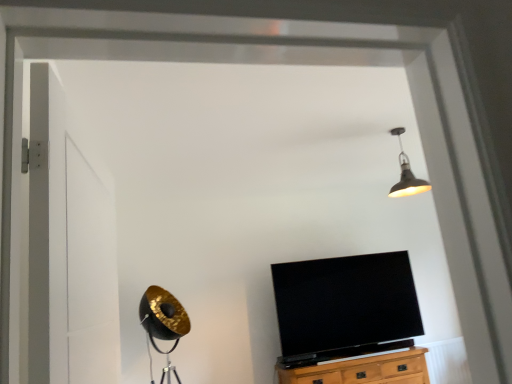
Question: Is metallic pendant light at upper center facing towards white matte door at left?

Choices:
 (A) yes
 (B) no

Answer: (B)

Question: Can you confirm if metallic pendant light at upper center is bigger than white matte door at left?

Choices:
 (A) yes
 (B) no

Answer: (B)

Question: Is metallic pendant light at upper center positioned far away from white matte door at left?

Choices:
 (A) no
 (B) yes

Answer: (B)

Question: Considering the relative positions of metallic pendant light at upper center and white matte door at left in the image provided, is metallic pendant light at upper center to the left of white matte door at left from the viewer's perspective?

Choices:
 (A) yes
 (B) no

Answer: (B)

Question: Considering the relative sizes of metallic pendant light at upper center and white matte door at left in the image provided, is metallic pendant light at upper center shorter than white matte door at left?

Choices:
 (A) no
 (B) yes

Answer: (B)

Question: From the image's perspective, is metallic pendant light at upper center located above white matte door at left?

Choices:
 (A) yes
 (B) no

Answer: (A)

Question: Considering the relative sizes of white matte door at left and metallic pendant light at upper center in the image provided, is white matte door at left shorter than metallic pendant light at upper center?

Choices:
 (A) no
 (B) yes

Answer: (A)

Question: Is metallic pendant light at upper center located within white matte door at left?

Choices:
 (A) yes
 (B) no

Answer: (B)

Question: Is white matte door at left located outside metallic pendant light at upper center?

Choices:
 (A) no
 (B) yes

Answer: (B)

Question: Does white matte door at left have a larger size compared to metallic pendant light at upper center?

Choices:
 (A) no
 (B) yes

Answer: (B)

Question: Does white matte door at left lie in front of metallic pendant light at upper center?

Choices:
 (A) no
 (B) yes

Answer: (B)

Question: From a real-world perspective, is white matte door at left on top of metallic pendant light at upper center?

Choices:
 (A) no
 (B) yes

Answer: (A)

Question: Is wooden cabinet at lower center not inside black glossy tv at center?

Choices:
 (A) yes
 (B) no

Answer: (A)